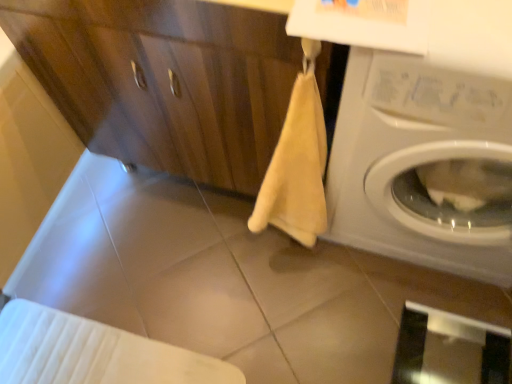
Question: Does beige matte tile at center have a smaller size compared to matte wood dresser at center?

Choices:
 (A) no
 (B) yes

Answer: (B)

Question: From a real-world perspective, is beige matte tile at center positioned over matte wood dresser at center based on gravity?

Choices:
 (A) yes
 (B) no

Answer: (B)

Question: From the image's perspective, is beige matte tile at center under matte wood dresser at center?

Choices:
 (A) no
 (B) yes

Answer: (B)

Question: Could you tell me if beige matte tile at center is turned towards matte wood dresser at center?

Choices:
 (A) yes
 (B) no

Answer: (B)

Question: Can you confirm if beige matte tile at center is thinner than matte wood dresser at center?

Choices:
 (A) no
 (B) yes

Answer: (B)

Question: Considering their positions, is transparent glass screen door at lower right located in front of or behind white glossy washing machine at right?

Choices:
 (A) behind
 (B) front

Answer: (A)

Question: From a real-world perspective, is transparent glass screen door at lower right above or below white glossy washing machine at right?

Choices:
 (A) below
 (B) above

Answer: (A)

Question: Considering the positions of transparent glass screen door at lower right and white glossy washing machine at right in the image, is transparent glass screen door at lower right taller or shorter than white glossy washing machine at right?

Choices:
 (A) short
 (B) tall

Answer: (A)

Question: Based on their sizes in the image, would you say transparent glass screen door at lower right is bigger or smaller than white glossy washing machine at right?

Choices:
 (A) small
 (B) big

Answer: (A)

Question: Is white glossy washing machine at right wider or thinner than transparent glass screen door at lower right?

Choices:
 (A) thin
 (B) wide

Answer: (B)

Question: Which is correct: white glossy washing machine at right is inside transparent glass screen door at lower right, or outside of it?

Choices:
 (A) inside
 (B) outside

Answer: (B)

Question: Looking at the image, does white glossy washing machine at right seem bigger or smaller compared to transparent glass screen door at lower right?

Choices:
 (A) small
 (B) big

Answer: (B)

Question: Considering their positions, is white glossy washing machine at right located in front of or behind transparent glass screen door at lower right?

Choices:
 (A) front
 (B) behind

Answer: (A)

Question: From a real-world perspective, is white glossy washing machine at right physically located above or below matte wood dresser at center?

Choices:
 (A) above
 (B) below

Answer: (A)

Question: In terms of height, does white glossy washing machine at right look taller or shorter compared to matte wood dresser at center?

Choices:
 (A) tall
 (B) short

Answer: (A)